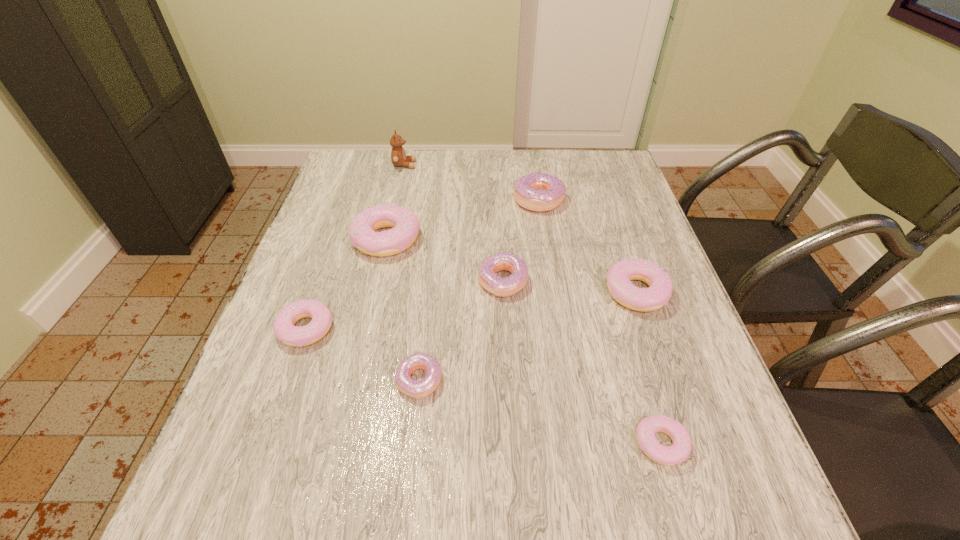
Select which doughnut is the fifth closest to the second smallest purple doughnut. Please provide its 2D coordinates. Your answer should be formatted as a tuple, i.e. [(x, y)], where the tuple contains the x and y coordinates of a point satisfying the conditions above.

[(285, 331)]

The height and width of the screenshot is (540, 960). Find the location of `the third closest doughnut relative to the tallest object`. the third closest doughnut relative to the tallest object is located at coordinates (502, 287).

I want to click on pink doughnut that is the third closest to the shortest object, so click(x=285, y=331).

This screenshot has width=960, height=540. Identify the location of pink doughnut that is the second closest to the second smallest purple doughnut. (658, 294).

Locate which purple doughnut is the second closest to the second nearest doughnut. Please provide its 2D coordinates. Your answer should be formatted as a tuple, i.e. [(x, y)], where the tuple contains the x and y coordinates of a point satisfying the conditions above.

[(540, 192)]

Where is `purple doughnut that stands as the closest to the second biggest purple doughnut`? The height and width of the screenshot is (540, 960). purple doughnut that stands as the closest to the second biggest purple doughnut is located at coordinates (420, 389).

The height and width of the screenshot is (540, 960). Identify the location of vacant area in the image that satisfies the following two spatial constraints: 1. on the front-facing side of the tallest object; 2. on the back side of the second farthest object. (396, 199).

What are the coordinates of `vacant area in the image that satisfies the following two spatial constraints: 1. on the front side of the third biggest pink doughnut; 2. on the right side of the nearest purple doughnut` in the screenshot? It's located at (287, 380).